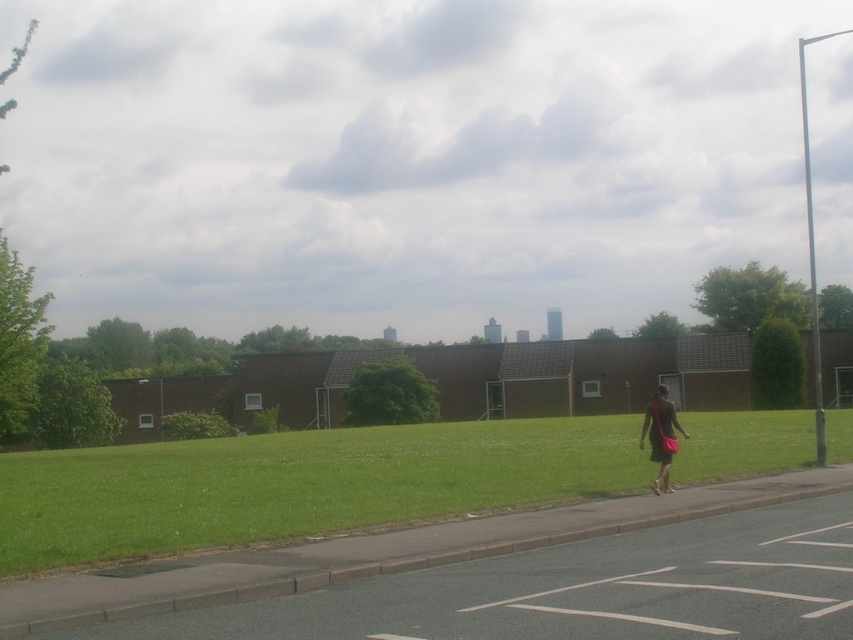
Is green grass at lower center further to the viewer compared to dark brown fabric dress at center-right?

That is False.

Who is lower down, green grass at lower center or dark brown fabric dress at center-right?

Positioned lower is green grass at lower center.

Does point (677, 483) come behind point (670, 449)?

That is True.

Locate an element on the screen. The image size is (853, 640). green grass at lower center is located at coordinates (297, 484).